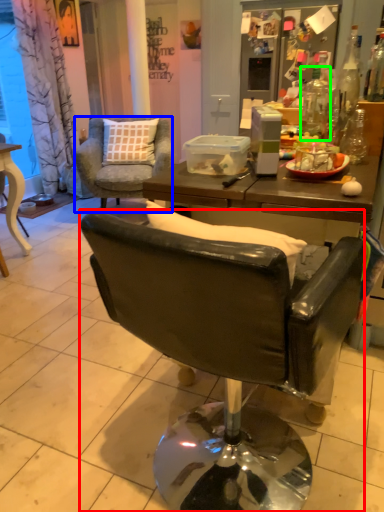
Question: Which object is positioned farthest from chair (highlighted by a red box)? Select from chair (highlighted by a blue box) and bottle (highlighted by a green box).

Choices:
 (A) chair
 (B) bottle

Answer: (A)